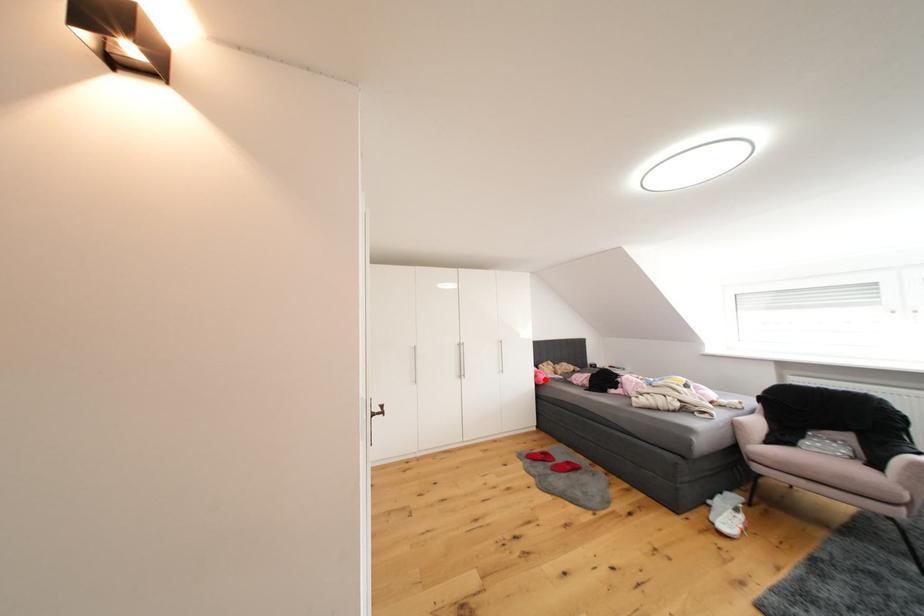
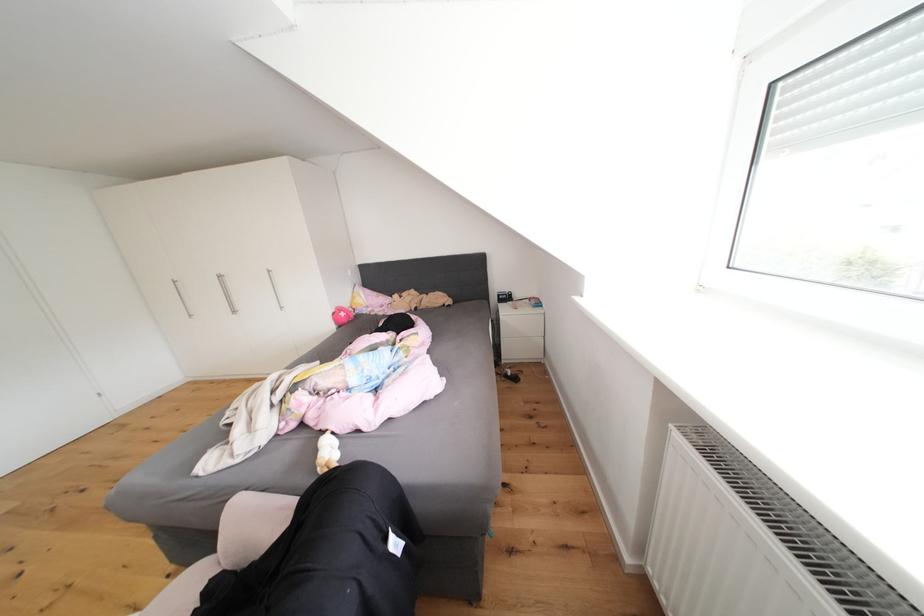
In the second image, find the point that corresponds to the highlighted location in the first image.

(343, 318)